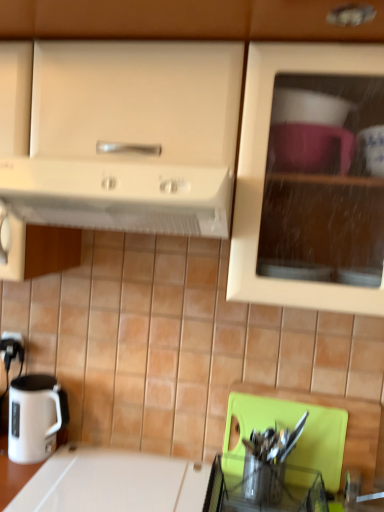
Question: Would you say white glossy countertop at lower left contains white glossy electric kettle at lower left?

Choices:
 (A) no
 (B) yes

Answer: (A)

Question: Considering the relative positions of white glossy countertop at lower left and white glossy electric kettle at lower left in the image provided, is white glossy countertop at lower left to the right of white glossy electric kettle at lower left from the viewer's perspective?

Choices:
 (A) yes
 (B) no

Answer: (A)

Question: Is white glossy countertop at lower left positioned far away from white glossy electric kettle at lower left?

Choices:
 (A) yes
 (B) no

Answer: (B)

Question: From a real-world perspective, is white glossy countertop at lower left physically below white glossy electric kettle at lower left?

Choices:
 (A) yes
 (B) no

Answer: (A)

Question: Is white glossy countertop at lower left in front of white glossy electric kettle at lower left?

Choices:
 (A) no
 (B) yes

Answer: (B)

Question: Can you confirm if white glossy countertop at lower left is bigger than white glossy electric kettle at lower left?

Choices:
 (A) no
 (B) yes

Answer: (B)

Question: Is white glossy countertop at lower left touching matte white cabinet at upper center?

Choices:
 (A) yes
 (B) no

Answer: (B)

Question: Is white glossy countertop at lower left taller than matte white cabinet at upper center?

Choices:
 (A) no
 (B) yes

Answer: (A)

Question: From the image's perspective, is white glossy countertop at lower left on top of matte white cabinet at upper center?

Choices:
 (A) yes
 (B) no

Answer: (B)

Question: Does white glossy countertop at lower left appear on the left side of matte white cabinet at upper center?

Choices:
 (A) no
 (B) yes

Answer: (B)

Question: Is white glossy countertop at lower left further to camera compared to matte white cabinet at upper center?

Choices:
 (A) yes
 (B) no

Answer: (A)

Question: From a real-world perspective, is white glossy countertop at lower left positioned over matte white cabinet at upper center based on gravity?

Choices:
 (A) yes
 (B) no

Answer: (B)

Question: Is matte white cabinet at upper center smaller than white glossy countertop at lower left?

Choices:
 (A) no
 (B) yes

Answer: (A)